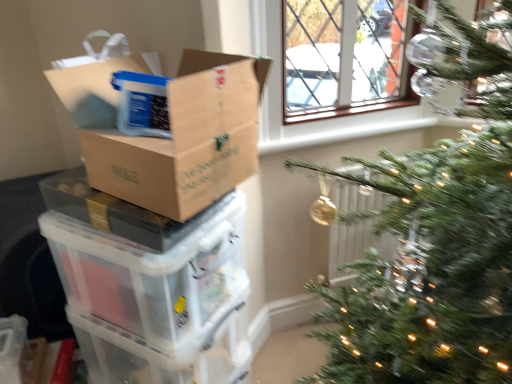
Question: In terms of size, does brown cardboard box at left appear bigger or smaller than transparent plastic storage box at lower left?

Choices:
 (A) small
 (B) big

Answer: (A)

Question: Is point (176, 104) closer or farther from the camera than point (138, 362)?

Choices:
 (A) farther
 (B) closer

Answer: (B)

Question: Which of these objects is positioned farthest from the white plastic radiator at center-right?

Choices:
 (A) brown cardboard box at left
 (B) transparent plastic storage box at lower left
 (C) translucent plastic storage box at left

Answer: (A)

Question: Considering the real-world distances, which object is closest to the transparent plastic storage box at lower left?

Choices:
 (A) white plastic radiator at center-right
 (B) brown cardboard box at left
 (C) translucent plastic storage box at left

Answer: (C)